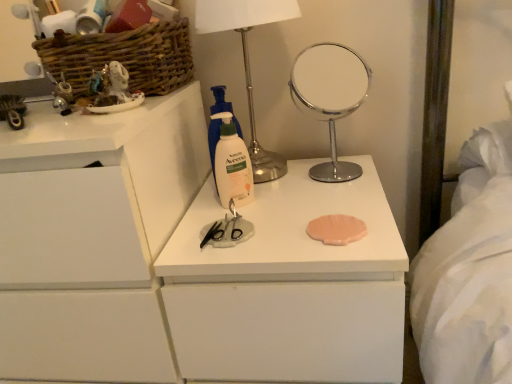
The image size is (512, 384). Find the location of `free location in front of matte white figurine at upper left`. free location in front of matte white figurine at upper left is located at coordinates (82, 128).